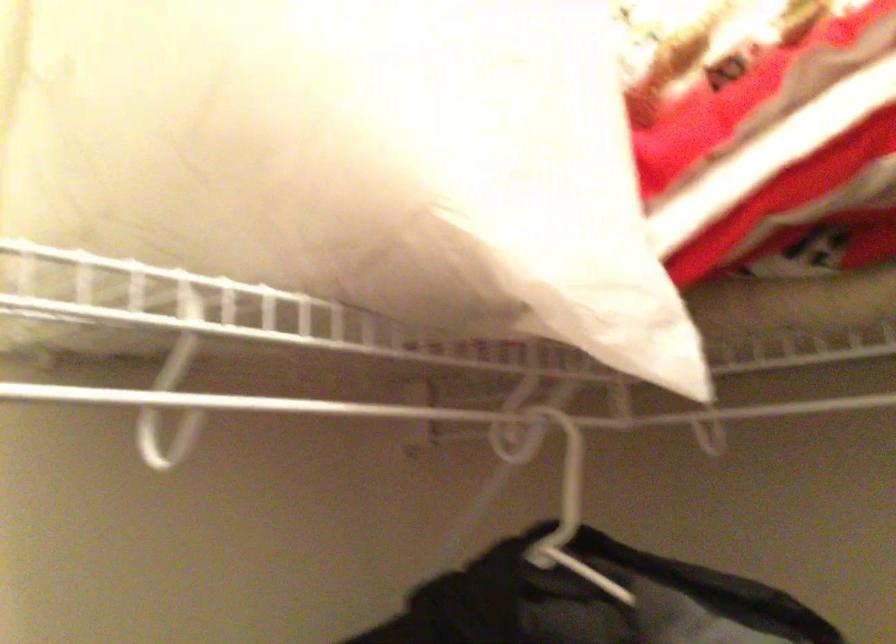
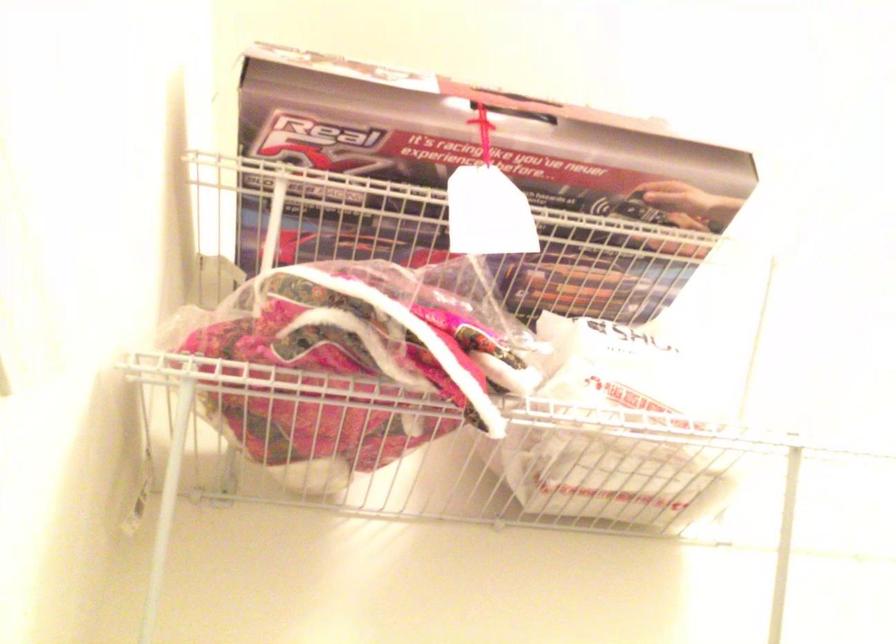
Looking at this image, first-person continuous shooting, in which direction is the camera rotating?

The rotation direction of the camera is left-up.